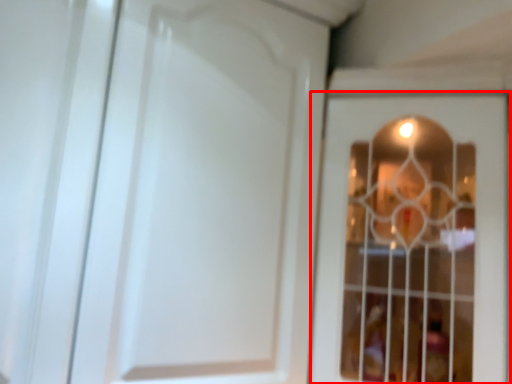
Question: Considering the relative positions of door (annotated by the red box) and door in the image provided, where is door (annotated by the red box) located with respect to the staircase?

Choices:
 (A) left
 (B) right

Answer: (B)